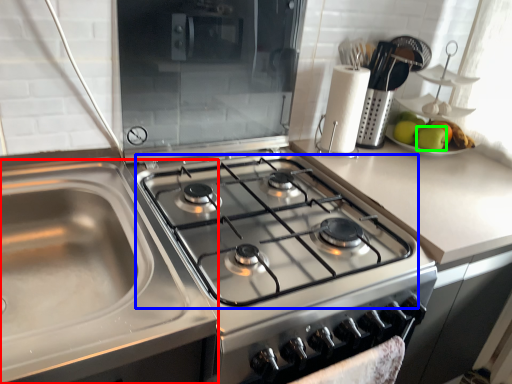
Question: Estimate the real-world distances between objects in this image. Which object is farther from sink (highlighted by a red box), gas stove (highlighted by a blue box) or apple (highlighted by a green box)?

Choices:
 (A) gas stove
 (B) apple

Answer: (B)